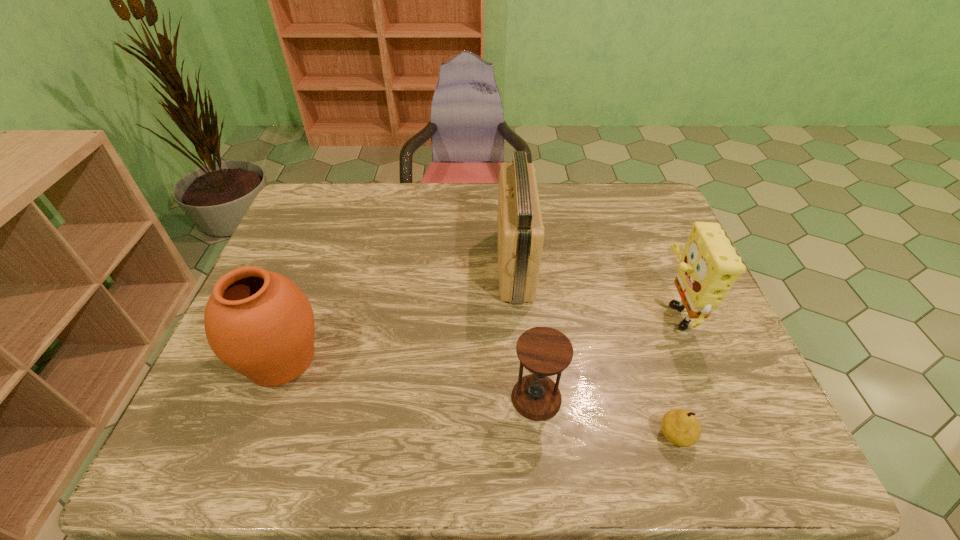
Where is `blank space located 0.290m on the face of the sponge`? The height and width of the screenshot is (540, 960). blank space located 0.290m on the face of the sponge is located at coordinates [542, 310].

Where is `free region located 0.390m on the face of the sponge`? The image size is (960, 540). free region located 0.390m on the face of the sponge is located at coordinates (504, 310).

At what (x,y) coordinates should I click in order to perform the action: click on free space located 0.140m on the face of the sponge. Please return your answer as a coordinate pair (x, y). The image size is (960, 540). Looking at the image, I should click on (600, 310).

This screenshot has height=540, width=960. In order to click on free space located on the right of the hourglass in this screenshot , I will do 731,397.

Find the location of a particular element. The image size is (960, 540). vacant space positioned 0.100m on the back of the second object from right to left is located at coordinates (658, 378).

Identify the location of object that is positioned at the near edge. This screenshot has height=540, width=960. (680, 427).

I want to click on object positioned at the left edge, so click(259, 323).

Find the location of `object located in the right edge section of the desktop`. object located in the right edge section of the desktop is located at coordinates (709, 265).

This screenshot has height=540, width=960. I want to click on free point at the far edge, so click(538, 190).

I want to click on vacant space at the left edge of the desktop, so click(292, 248).